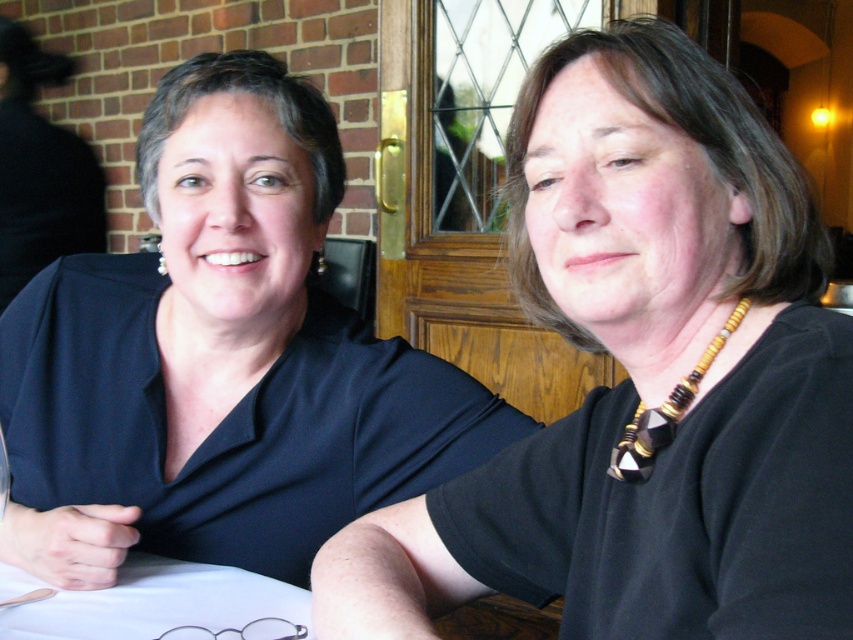
You are an interior designer analyzing the placement of objects in this image. The black matte necklace at upper center is located at a specific coordinate. Can you determine if this coordinate falls within the area of the brick wall in the background?

The black matte necklace at upper center is located at point (645, 378). Since the brick wall is part of the background and the necklace is an object on the person, it is positioned in the foreground. Coordinates typically map from the bottom left corner, so 0.591 on the x and 0.757 on the y would place it above the lower half, likely on the person and not the wall.